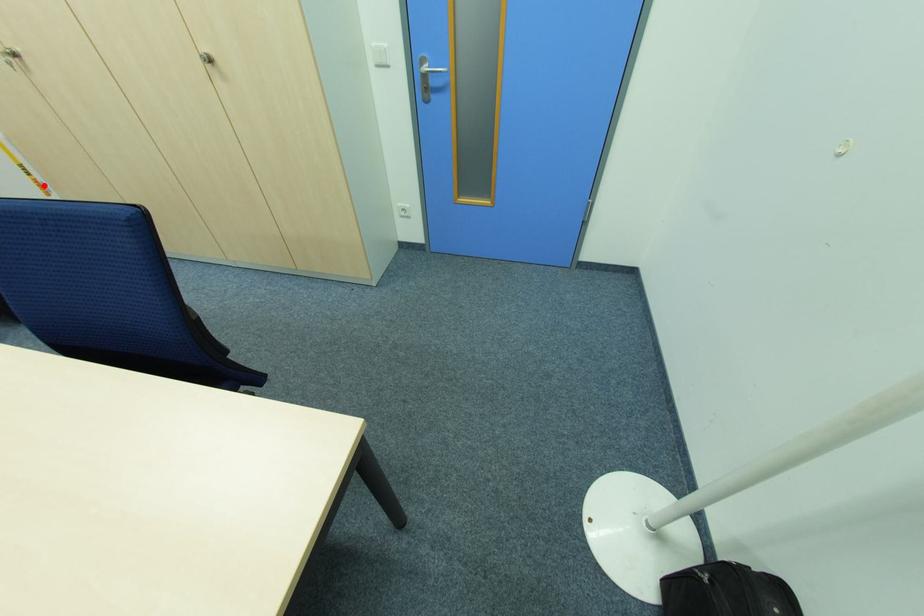
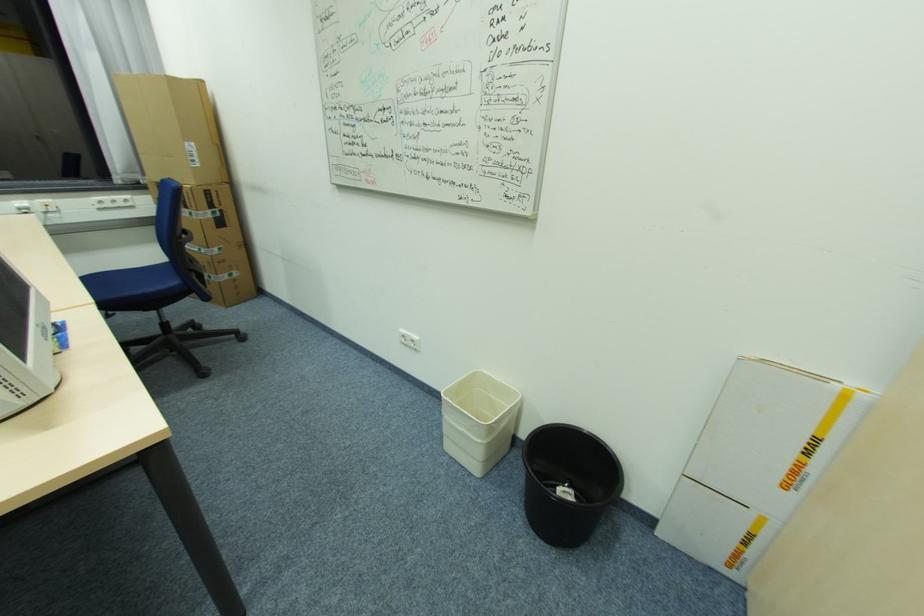
Where in the second image is the point corresponding to the highlighted location from the first image?

(797, 472)